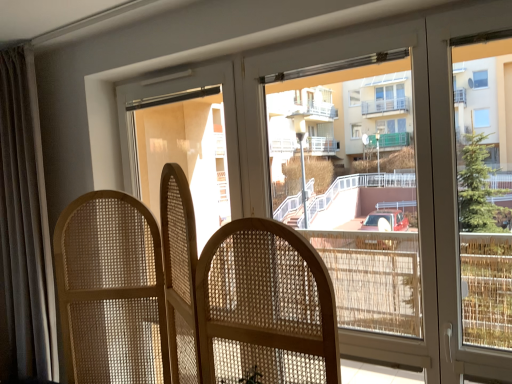
Question: Is natural wood screen at center positioned beyond the bounds of dark gray fabric curtain at left?

Choices:
 (A) no
 (B) yes

Answer: (B)

Question: Is natural wood screen at center positioned before dark gray fabric curtain at left?

Choices:
 (A) no
 (B) yes

Answer: (B)

Question: Would you say natural wood screen at center contains dark gray fabric curtain at left?

Choices:
 (A) yes
 (B) no

Answer: (B)

Question: From the image's perspective, is natural wood screen at center under dark gray fabric curtain at left?

Choices:
 (A) yes
 (B) no

Answer: (A)

Question: From the image's perspective, would you say natural wood screen at center is positioned over dark gray fabric curtain at left?

Choices:
 (A) yes
 (B) no

Answer: (B)

Question: From a real-world perspective, is natural wood screen at center located higher than dark gray fabric curtain at left?

Choices:
 (A) yes
 (B) no

Answer: (B)

Question: From a real-world perspective, is dark gray fabric curtain at left on top of natural wood screen at center?

Choices:
 (A) yes
 (B) no

Answer: (A)

Question: Is dark gray fabric curtain at left facing towards natural wood screen at center?

Choices:
 (A) yes
 (B) no

Answer: (B)

Question: Are dark gray fabric curtain at left and natural wood screen at center beside each other?

Choices:
 (A) yes
 (B) no

Answer: (B)

Question: Is dark gray fabric curtain at left to the left of natural wood screen at center from the viewer's perspective?

Choices:
 (A) no
 (B) yes

Answer: (B)

Question: Does dark gray fabric curtain at left come behind natural wood screen at center?

Choices:
 (A) no
 (B) yes

Answer: (B)

Question: Is dark gray fabric curtain at left thinner than natural wood screen at center?

Choices:
 (A) yes
 (B) no

Answer: (A)

Question: Based on their positions, is natural wood screen at center located to the left or right of dark gray fabric curtain at left?

Choices:
 (A) left
 (B) right

Answer: (B)